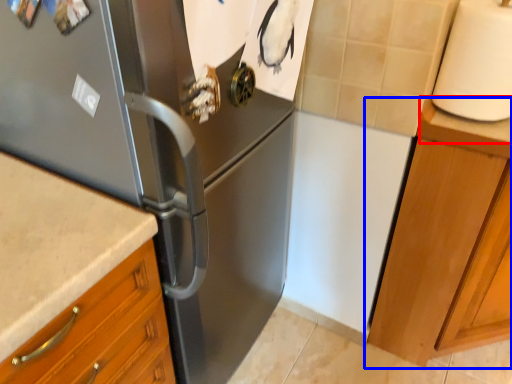
Question: Which object appears closest to the camera in this image, counter top (highlighted by a red box) or cabinetry (highlighted by a blue box)?

Choices:
 (A) counter top
 (B) cabinetry

Answer: (B)